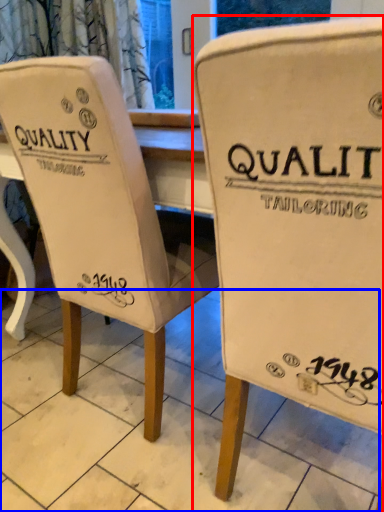
Question: Which object appears closest to the camera in this image, chair (highlighted by a red box) or tile (highlighted by a blue box)?

Choices:
 (A) chair
 (B) tile

Answer: (A)